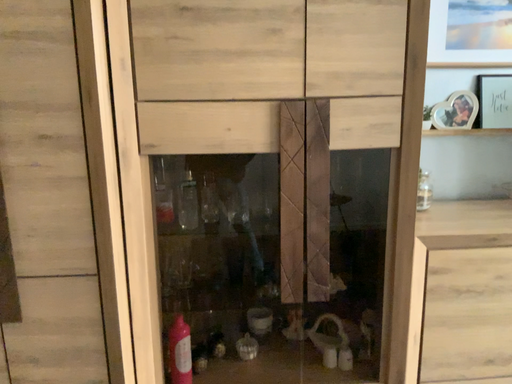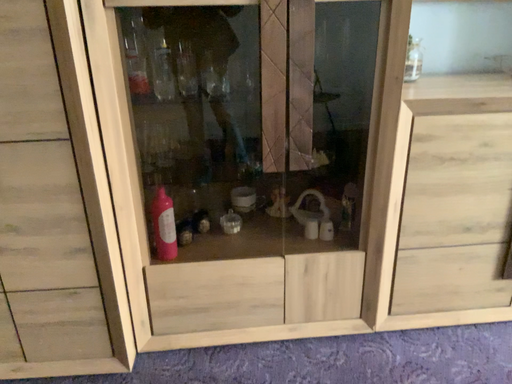
Question: How did the camera likely rotate when shooting the video?

Choices:
 (A) rotated downward
 (B) rotated upward

Answer: (A)